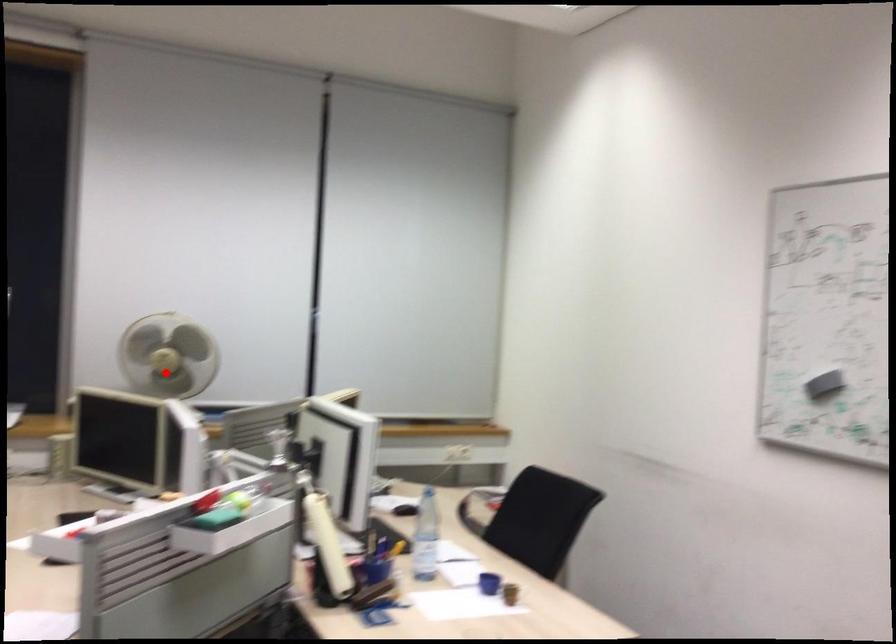
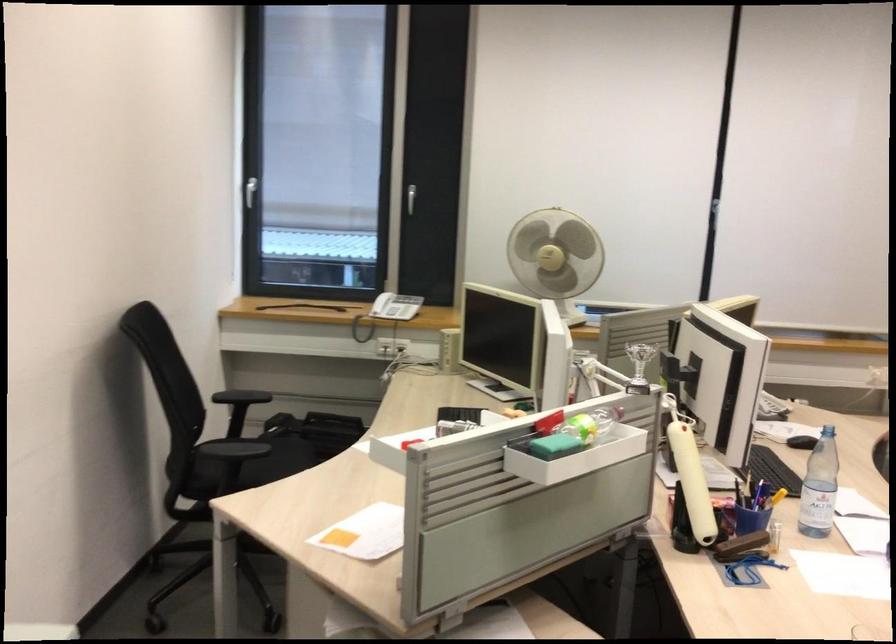
Question: I am providing you with two images of the same scene from different viewpoints. Given a red point in image1, look at the same physical point in image2. Is it:

Choices:
 (A) Closer to the viewpoint
 (B) Farther from the viewpoint

Answer: (A)